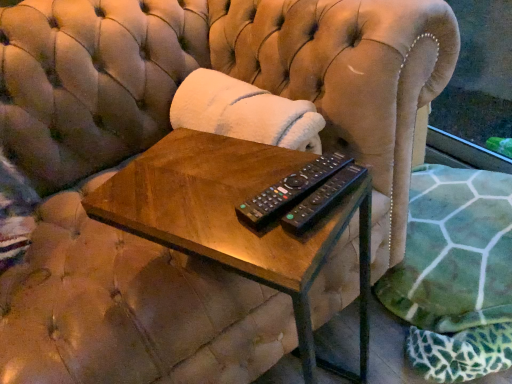
Where is `unoccupied space behind black plastic remote at center, which appears as the 2th remote control when viewed from the front`? This screenshot has width=512, height=384. unoccupied space behind black plastic remote at center, which appears as the 2th remote control when viewed from the front is located at coordinates (252, 158).